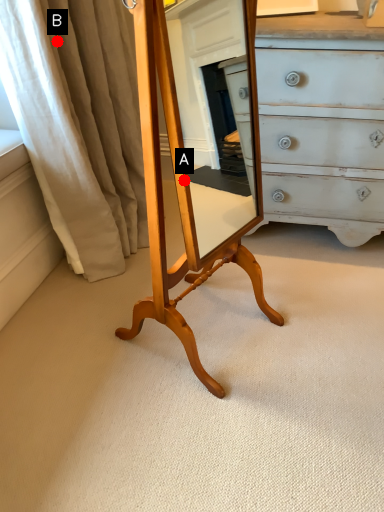
Question: Two points are circled on the image, labeled by A and B beside each circle. Which point appears closest to the camera in this image?

Choices:
 (A) A is closer
 (B) B is closer

Answer: (A)